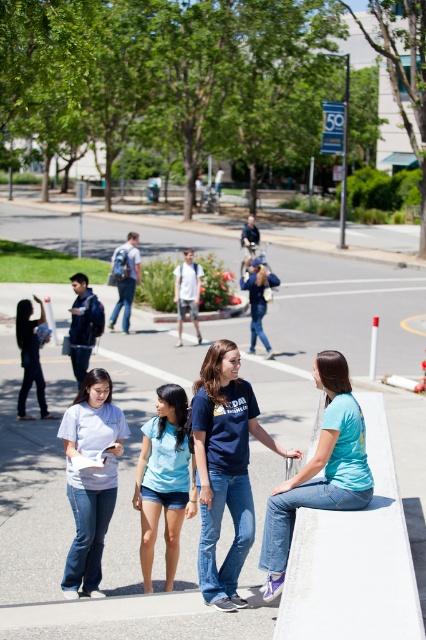
Question: From the image, what is the correct spatial relationship of matte blue t-shirt at center in relation to blue cotton shirt at center?

Choices:
 (A) below
 (B) above

Answer: (B)

Question: Among these objects, which one is farthest from the camera?

Choices:
 (A) blue cotton shirt at center
 (B) matte black backpack at left
 (C) white concrete bench at lower right

Answer: (B)

Question: Does light blue t-shirt at lower right appear under blue cotton shirt at center?

Choices:
 (A) yes
 (B) no

Answer: (B)

Question: Observing the image, what is the correct spatial positioning of blue cotton shirt at center in reference to matte black backpack at left?

Choices:
 (A) right
 (B) left

Answer: (A)

Question: Which point is closer to the camera?

Choices:
 (A) white matte t-shirt at lower left
 (B) light blue t-shirt at lower right

Answer: (B)

Question: Which object appears farthest from the camera in this image?

Choices:
 (A) white matte t-shirt at lower left
 (B) light blue t-shirt at lower right

Answer: (A)